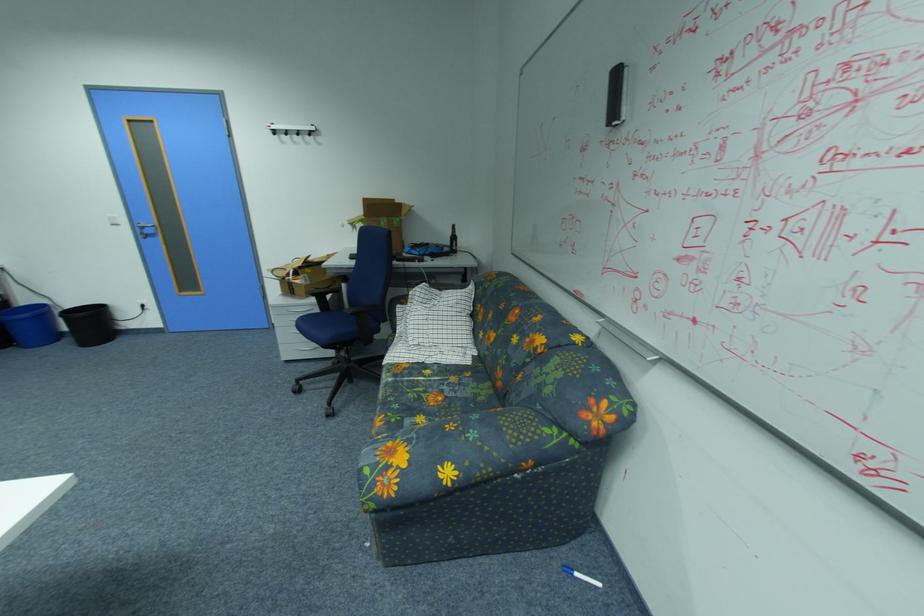
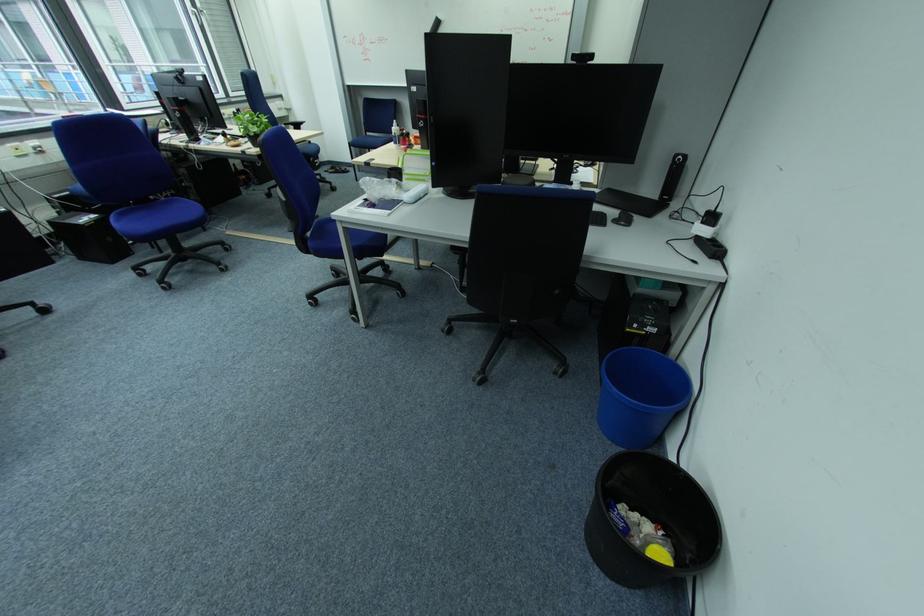
Find the pixel in the second image that matches [89,350] in the first image.

(596, 514)